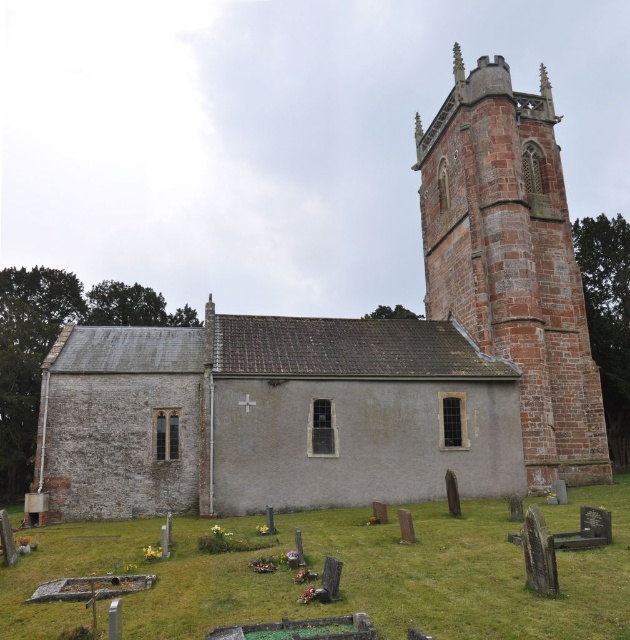
How distant is smooth stone church at center from rustic stone tower at right?

The distance of smooth stone church at center from rustic stone tower at right is 3.94 meters.

Locate an element on the screen. smooth stone church at center is located at coordinates (357, 360).

Is point (180, 371) positioned in front of point (539, 276)?

Yes, point (180, 371) is in front of point (539, 276).

Identify the location of smooth stone church at center. The height and width of the screenshot is (640, 630). (357, 360).